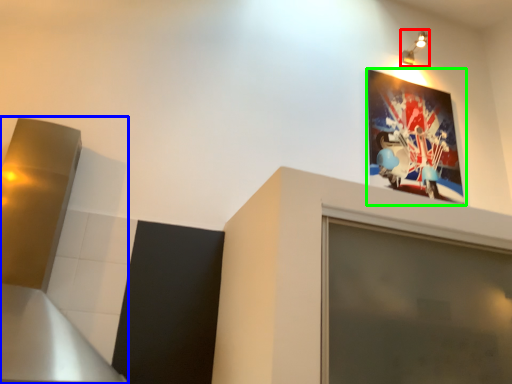
Question: Which object is positioned farthest from light fixture (highlighted by a red box)? Select from exhaust hood (highlighted by a blue box) and picture frame (highlighted by a green box).

Choices:
 (A) exhaust hood
 (B) picture frame

Answer: (A)